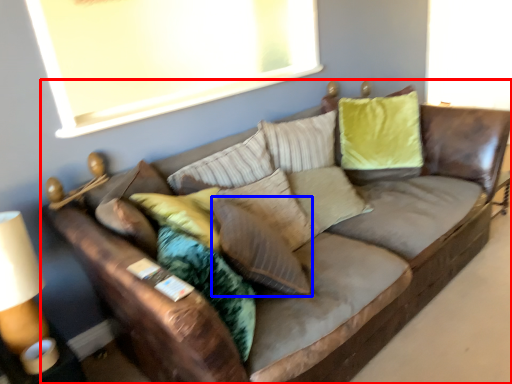
Question: Which object appears closest to the camera in this image, studio couch (highlighted by a red box) or pillow (highlighted by a blue box)?

Choices:
 (A) studio couch
 (B) pillow

Answer: (A)